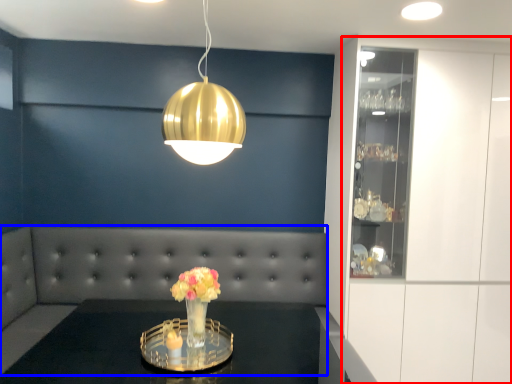
Question: Which object appears closest to the camera in this image, cabinetry (highlighted by a red box) or couch (highlighted by a blue box)?

Choices:
 (A) cabinetry
 (B) couch

Answer: (B)